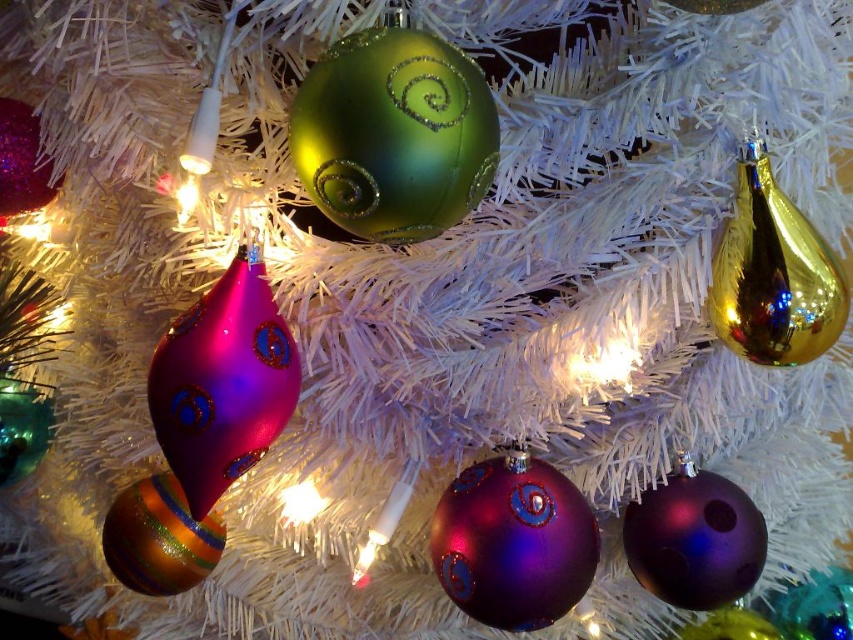
From the picture: You are standing in front of the Christmas tree and want to find the green glossy ornament at upper center. According to its coordinates, where exactly should you look on the tree?

The green glossy ornament at upper center is located at coordinates point (393, 134) on the tree.